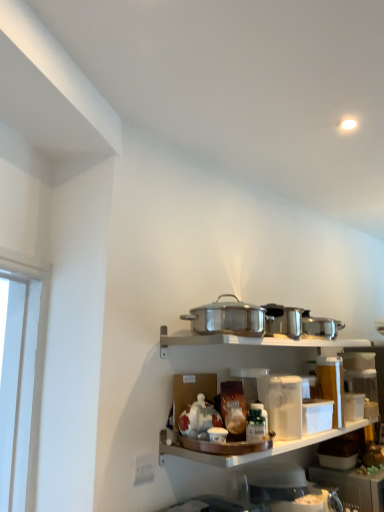
Question: Considering the relative sizes of white plastic container at lower right, placed as the 1th appliance when sorted from back to front, and white matte container at center in the image provided, is white plastic container at lower right, placed as the 1th appliance when sorted from back to front, smaller than white matte container at center?

Choices:
 (A) no
 (B) yes

Answer: (A)

Question: Can you confirm if white plastic container at lower right, positioned as the 1th appliance in right-to-left order, is thinner than white matte container at center?

Choices:
 (A) yes
 (B) no

Answer: (B)

Question: Considering the relative sizes of white plastic container at lower right, positioned as the 1th appliance in right-to-left order, and white matte container at center in the image provided, is white plastic container at lower right, positioned as the 1th appliance in right-to-left order, shorter than white matte container at center?

Choices:
 (A) no
 (B) yes

Answer: (A)

Question: From the image's perspective, is white plastic container at lower right, the 2th appliance positioned from the left, beneath white matte container at center?

Choices:
 (A) no
 (B) yes

Answer: (B)

Question: Does white plastic container at lower right, the 2th appliance positioned from the left, turn towards white matte container at center?

Choices:
 (A) yes
 (B) no

Answer: (B)

Question: From a real-world perspective, is white plastic container at lower right, which appears as the second appliance when viewed from the top, below white matte container at center?

Choices:
 (A) no
 (B) yes

Answer: (B)

Question: Is white plastic container at lower right, which is the second appliance in front-to-back order, not close to stainless steel pot at center, the first appliance from the top?

Choices:
 (A) no
 (B) yes

Answer: (A)

Question: Is white plastic container at lower right, placed as the 1th appliance when sorted from back to front, located outside stainless steel pot at center, arranged as the first appliance when viewed from the left?

Choices:
 (A) yes
 (B) no

Answer: (A)

Question: From a real-world perspective, does white plastic container at lower right, the 2th appliance positioned from the left, sit lower than stainless steel pot at center, arranged as the second appliance when viewed from the back?

Choices:
 (A) no
 (B) yes

Answer: (B)

Question: Does white plastic container at lower right, which appears as the second appliance when viewed from the top, have a greater height compared to stainless steel pot at center, arranged as the first appliance when viewed from the left?

Choices:
 (A) no
 (B) yes

Answer: (B)

Question: Is the position of white plastic container at lower right, which appears as the second appliance when viewed from the top, more distant than that of stainless steel pot at center, the first appliance from the top?

Choices:
 (A) no
 (B) yes

Answer: (B)

Question: Is white plastic container at lower right, placed as the 1th appliance when sorted from back to front, facing towards stainless steel pot at center, arranged as the first appliance when viewed from the left?

Choices:
 (A) no
 (B) yes

Answer: (A)

Question: Can you confirm if white matte container at center is smaller than white plastic container at lower right, the 2th appliance positioned from the left?

Choices:
 (A) yes
 (B) no

Answer: (A)